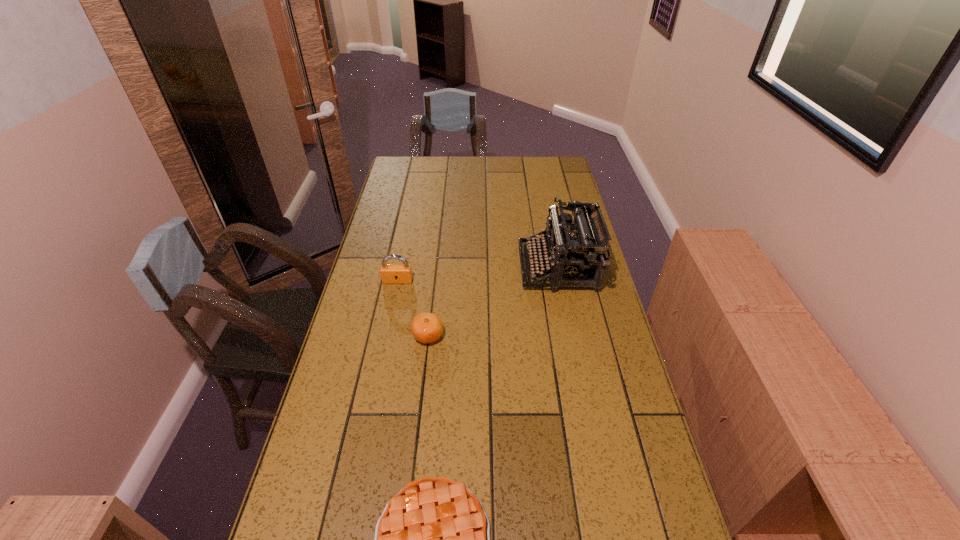
Locate which object ranks in proximity to the shortest object. Please provide its 2D coordinates. Your answer should be formatted as a tuple, i.e. [(x, y)], where the tuple contains the x and y coordinates of a point satisfying the conditions above.

[(427, 327)]

Locate an element on the screen. This screenshot has height=540, width=960. object that is the second nearest to the pie is located at coordinates [580, 255].

Where is `vacant space that satisfies the following two spatial constraints: 1. on the typing side of the typewriter; 2. on the front side of the third tallest object`? The height and width of the screenshot is (540, 960). vacant space that satisfies the following two spatial constraints: 1. on the typing side of the typewriter; 2. on the front side of the third tallest object is located at coordinates (571, 336).

At what (x,y) coordinates should I click in order to perform the action: click on free spot that satisfies the following two spatial constraints: 1. to unlock the second shortest object from the front; 2. on the left side of the third shortest object. Please return your answer as a coordinate pair (x, y). The width and height of the screenshot is (960, 540). Looking at the image, I should click on (386, 336).

Image resolution: width=960 pixels, height=540 pixels. Find the location of `vacant point that satisfies the following two spatial constraints: 1. to unlock the second tallest object from the front; 2. on the left side of the second nearest object`. vacant point that satisfies the following two spatial constraints: 1. to unlock the second tallest object from the front; 2. on the left side of the second nearest object is located at coordinates (386, 336).

Where is `free spot that satisfies the following two spatial constraints: 1. on the typing side of the typewriter; 2. to unlock the third shortest object from the front`? This screenshot has height=540, width=960. free spot that satisfies the following two spatial constraints: 1. on the typing side of the typewriter; 2. to unlock the third shortest object from the front is located at coordinates (561, 281).